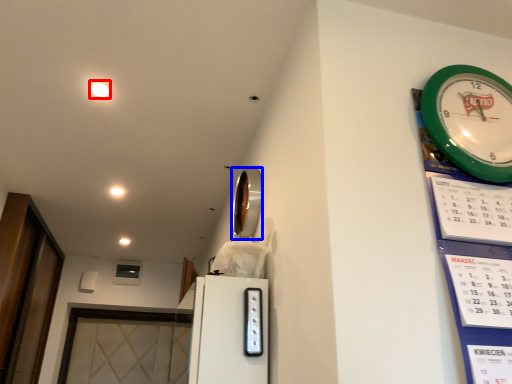
Question: Which point is closer to the camera, light (highlighted by a red box) or mirror (highlighted by a blue box)?

Choices:
 (A) light
 (B) mirror

Answer: (B)